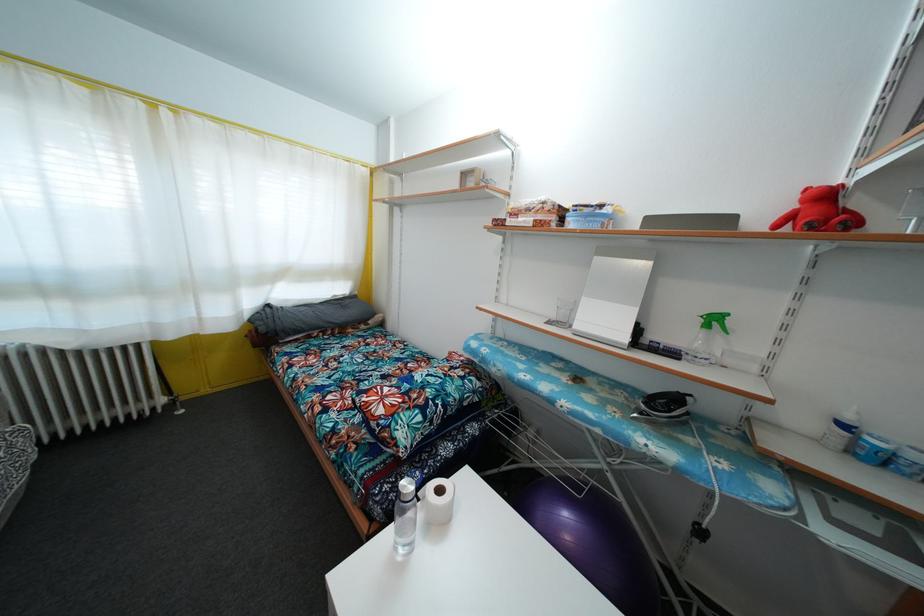
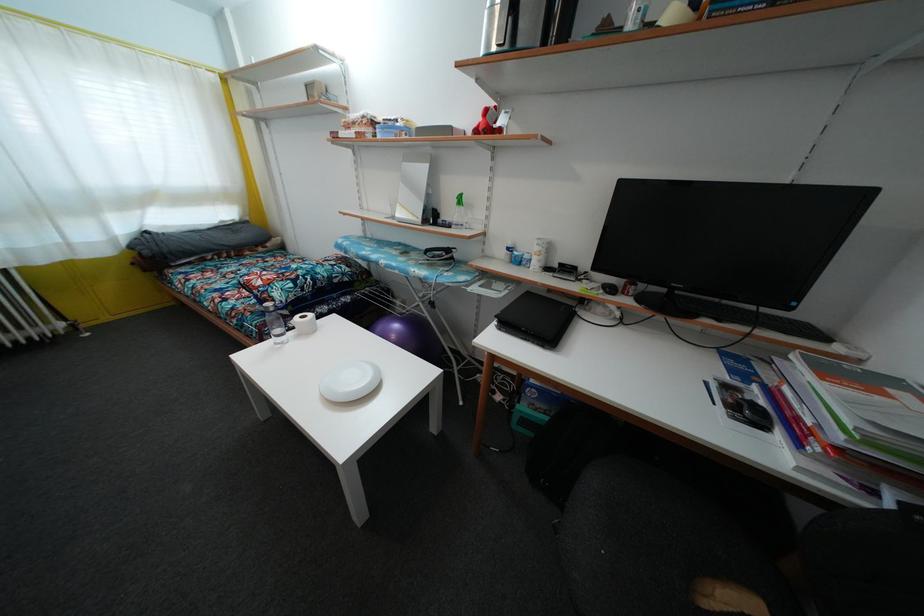
Find the pixel in the second image that matches point (827, 201) in the first image.

(490, 119)